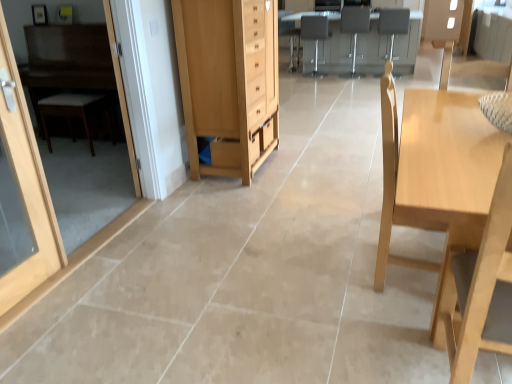
Question: From a real-world perspective, is light wood chair at right beneath matte gray armchair at center, which ranks as the first armchair in left-to-right order?

Choices:
 (A) no
 (B) yes

Answer: (A)

Question: Is light wood chair at right oriented away from matte gray armchair at center, which ranks as the first armchair in left-to-right order?

Choices:
 (A) yes
 (B) no

Answer: (B)

Question: From the image's perspective, is light wood chair at right on top of matte gray armchair at center, the 3th armchair in the right-to-left sequence?

Choices:
 (A) yes
 (B) no

Answer: (B)

Question: From the image's perspective, does light wood chair at right appear lower than matte gray armchair at center, the 3th armchair in the right-to-left sequence?

Choices:
 (A) yes
 (B) no

Answer: (A)

Question: Can you confirm if light wood chair at right is taller than matte gray armchair at center, which ranks as the first armchair in left-to-right order?

Choices:
 (A) no
 (B) yes

Answer: (B)

Question: Is point (55, 135) positioned closer to the camera than point (468, 296)?

Choices:
 (A) farther
 (B) closer

Answer: (A)

Question: Considering their positions, is transparent glass door at left, positioned as the first screen door in front-to-back order, located in front of or behind light wood chair at right?

Choices:
 (A) front
 (B) behind

Answer: (B)

Question: In terms of height, does transparent glass door at left, which is the 2th screen door in back-to-front order, look taller or shorter compared to light wood chair at right?

Choices:
 (A) short
 (B) tall

Answer: (B)

Question: Based on their positions, is transparent glass door at left, positioned as the first screen door in front-to-back order, located to the left or right of light wood chair at right?

Choices:
 (A) left
 (B) right

Answer: (A)

Question: From a real-world perspective, relative to light wood chair at right, is light wood cabinet at center vertically above or below?

Choices:
 (A) above
 (B) below

Answer: (A)

Question: From the image's perspective, is light wood cabinet at center positioned above or below light wood chair at right?

Choices:
 (A) below
 (B) above

Answer: (B)

Question: Considering the positions of point (224, 165) and point (500, 240), is point (224, 165) closer or farther from the camera than point (500, 240)?

Choices:
 (A) farther
 (B) closer

Answer: (A)

Question: Looking at the image, does light wood cabinet at center seem bigger or smaller compared to light wood chair at right?

Choices:
 (A) big
 (B) small

Answer: (A)

Question: In terms of height, does matte gray armchair at upper center, positioned as the third armchair in left-to-right order, look taller or shorter compared to transparent glass door at left, which is the 2th screen door in back-to-front order?

Choices:
 (A) tall
 (B) short

Answer: (B)

Question: Is point (403, 8) positioned closer to the camera than point (93, 198)?

Choices:
 (A) closer
 (B) farther

Answer: (B)